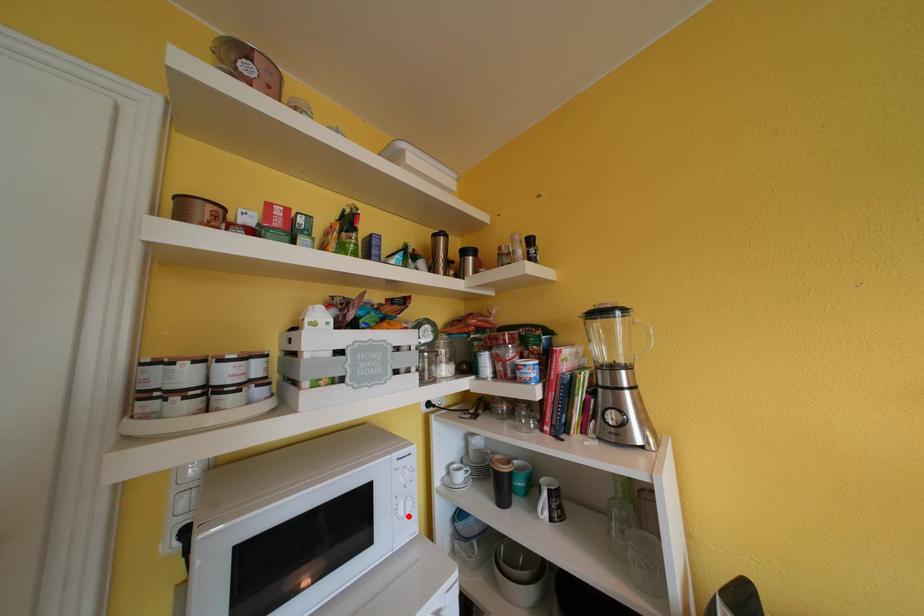
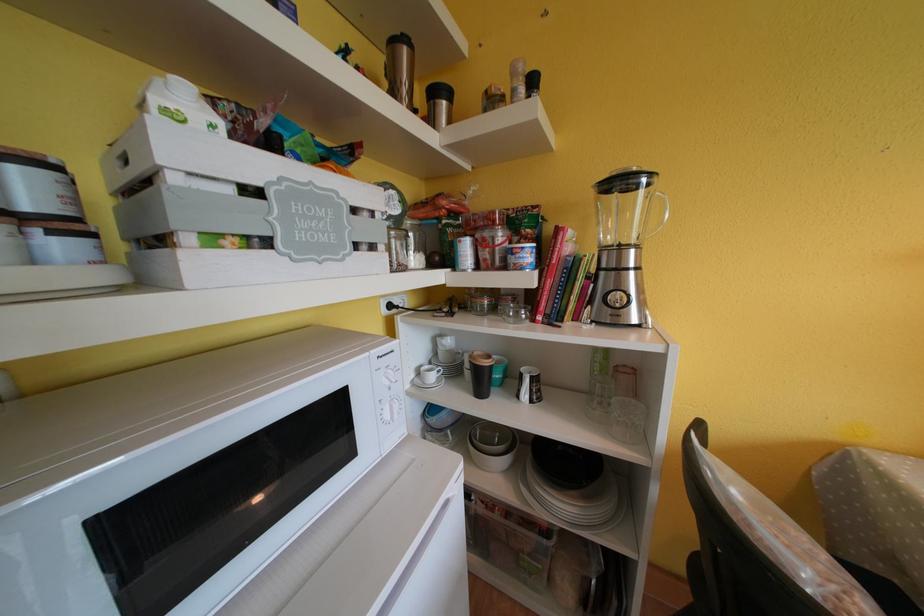
Question: A red point is marked in image1. In image2, is the corresponding 3D point closer to the camera or farther? Reply with the corresponding letter.

Choices:
 (A) The corresponding 3D point is closer.
 (B) The corresponding 3D point is farther.

Answer: (A)